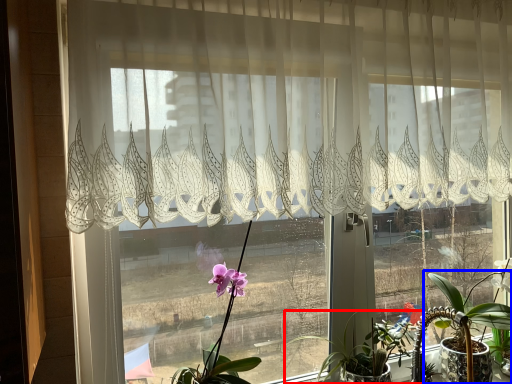
Question: Which of the following is the farthest to the observer, houseplant (highlighted by a red box) or houseplant (highlighted by a blue box)?

Choices:
 (A) houseplant
 (B) houseplant

Answer: (B)